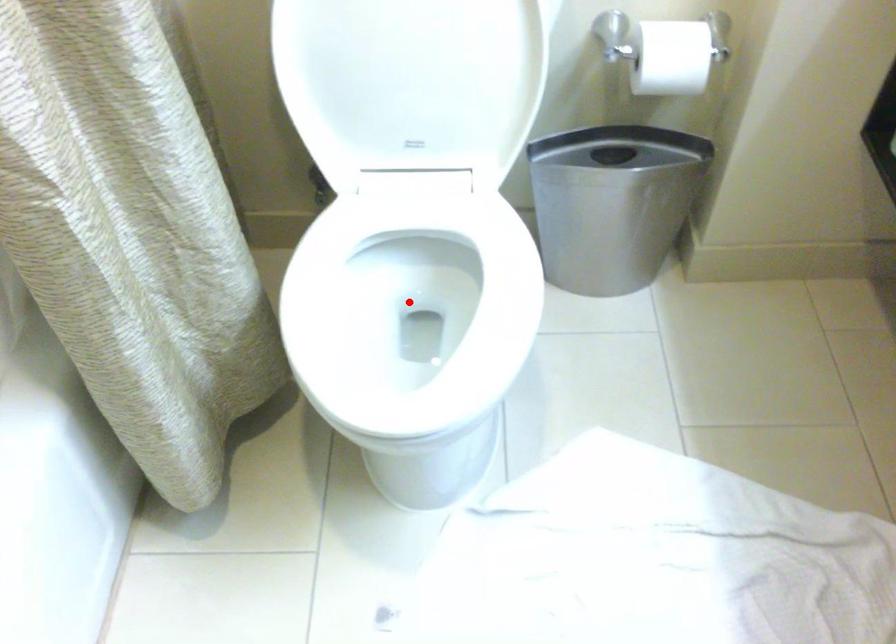
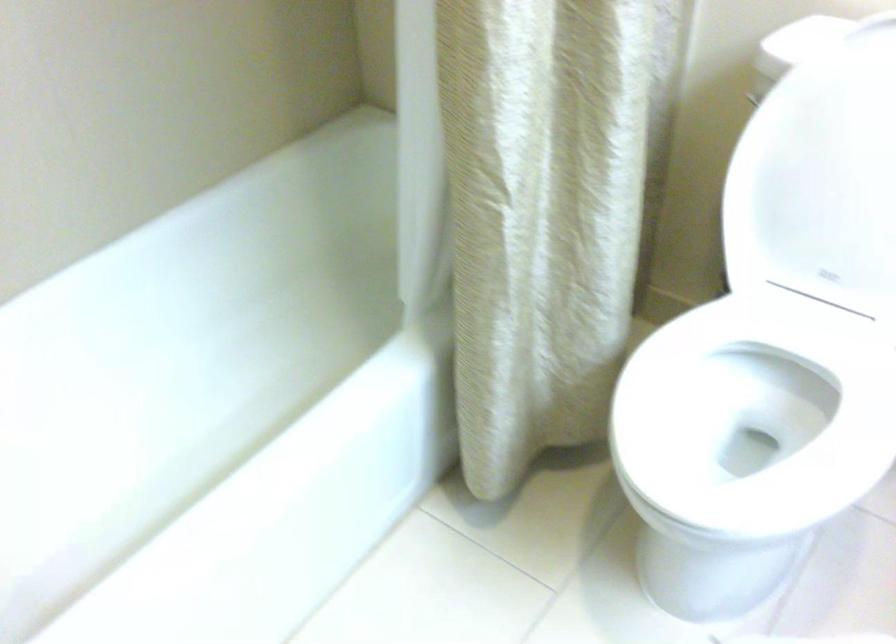
Question: I am providing you with two images of the same scene from different viewpoints. A red point is marked on the first image. Is the red point's position out of view in image 2?

Choices:
 (A) Yes
 (B) No

Answer: (B)